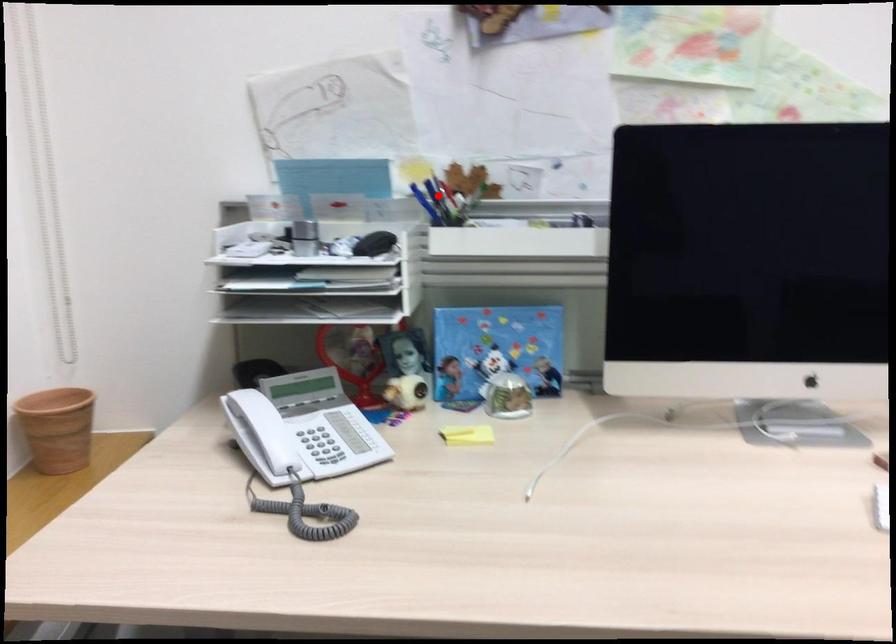
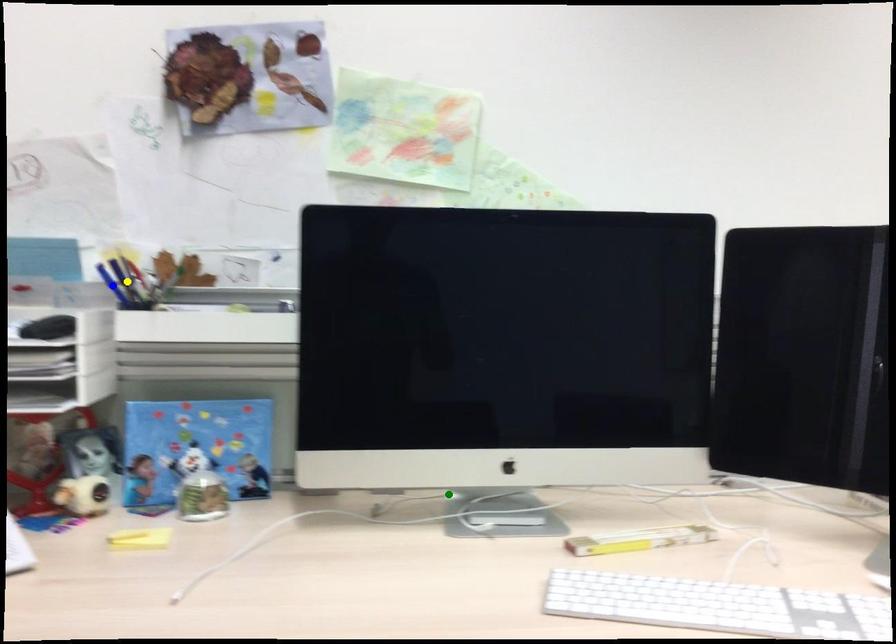
Question: I am providing you with two images of the same scene from different viewpoints. A red point is marked on the first image. You are given multiple points on the second image. Which mark in image 2 goes with the point in image 1?

Choices:
 (A) green point
 (B) blue point
 (C) yellow point

Answer: (C)